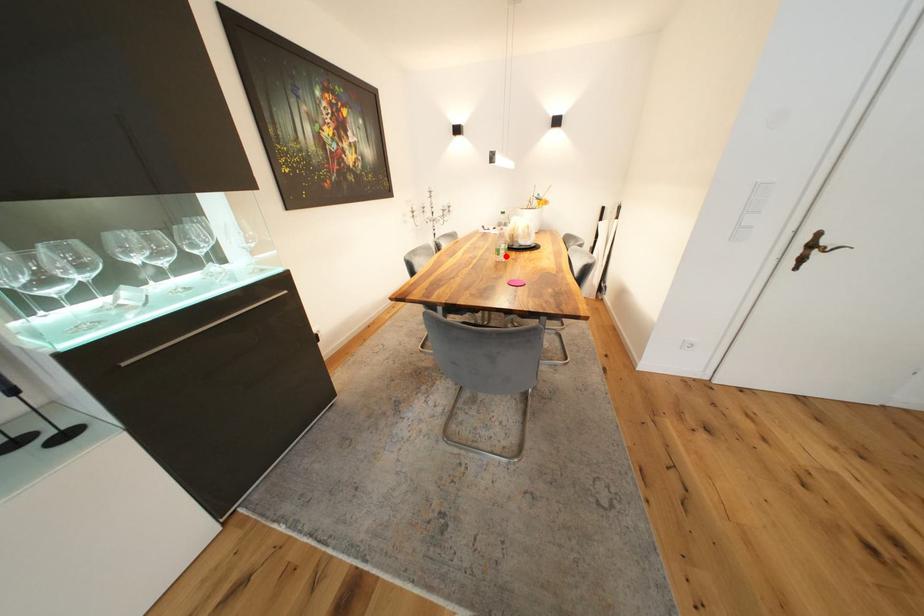
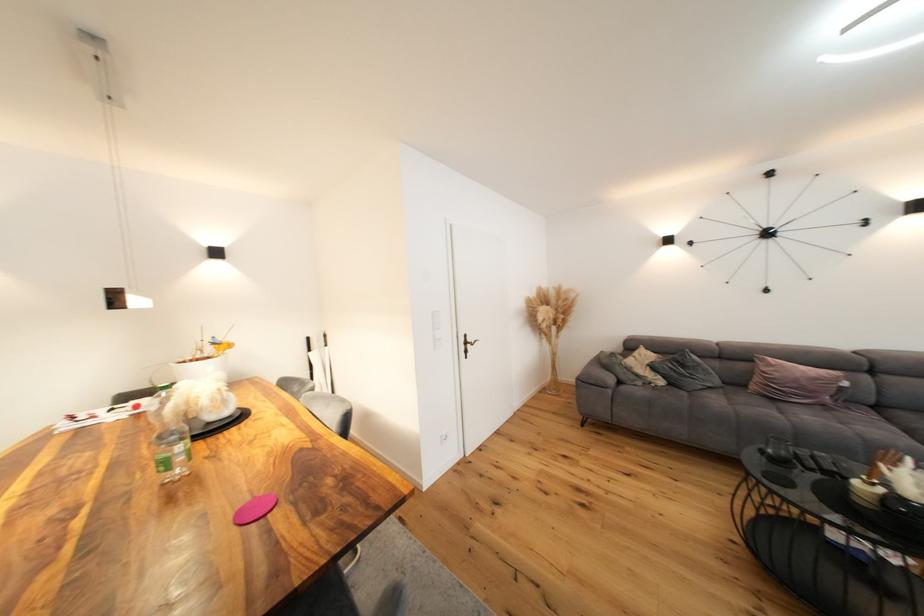
Locate, in the second image, the point that corresponds to the highlighted location in the first image.

(176, 469)